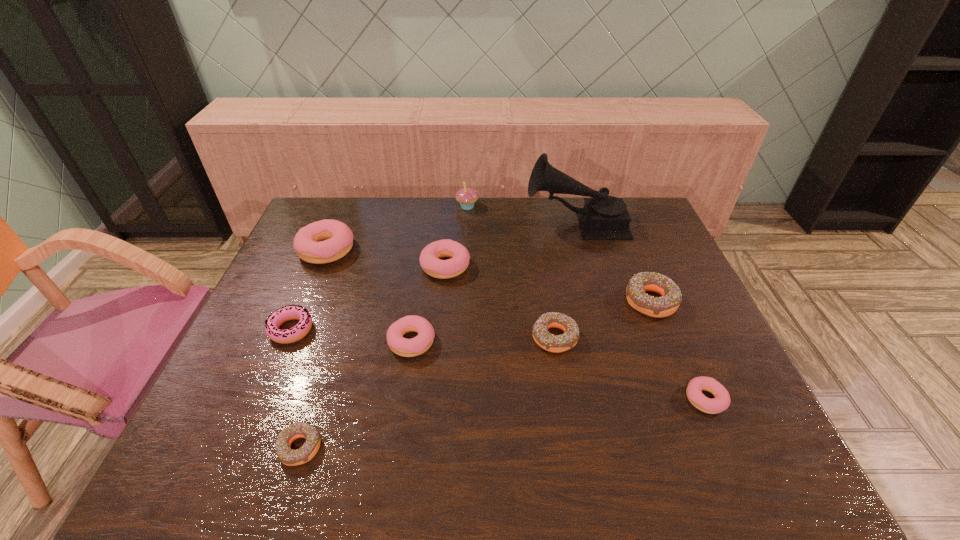
The height and width of the screenshot is (540, 960). In order to click on the tallest object in this screenshot , I will do `click(603, 217)`.

I want to click on phonograph_record, so pos(603,217).

Where is `the ninth shortest object`? the ninth shortest object is located at coordinates (467, 197).

I want to click on pink cupcake, so click(467, 197).

At what (x,y) coordinates should I click in order to perform the action: click on the biggest pink doughnut. Please return your answer as a coordinate pair (x, y). This screenshot has width=960, height=540. Looking at the image, I should click on (325, 241).

Locate an element on the screen. the tallest doughnut is located at coordinates (325, 241).

You are a GUI agent. You are given a task and a screenshot of the screen. Output one action in this format:
    pyautogui.click(x=<x>, y=<y>)
    Task: Click on the fourth smallest pink doughnut
    The width and height of the screenshot is (960, 540).
    Given the screenshot: What is the action you would take?
    pyautogui.click(x=429, y=258)

I want to click on the biggest chocolate doughnut, so click(658, 307).

The height and width of the screenshot is (540, 960). In order to click on the third smallest pink doughnut in this screenshot , I will do `click(401, 346)`.

The image size is (960, 540). I want to click on the second smallest chocolate doughnut, so (x=553, y=343).